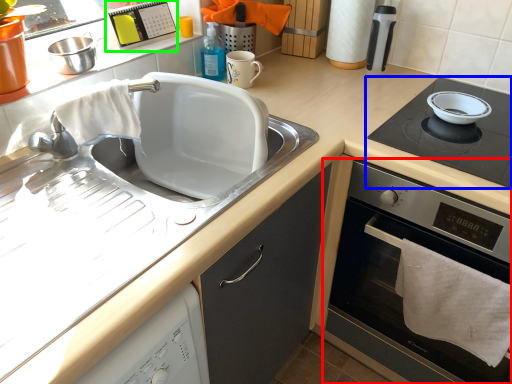
Question: Which object is positioned farthest from home appliance (highlighted by a red box)? Select from gas stove (highlighted by a blue box) and appliance (highlighted by a green box).

Choices:
 (A) gas stove
 (B) appliance

Answer: (B)